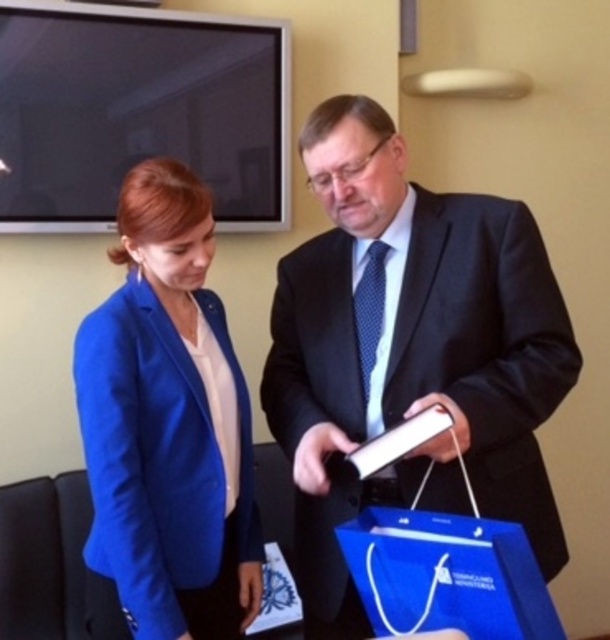
Question: Does matte black suit at center have a greater width compared to blue fabric jacket at left?

Choices:
 (A) no
 (B) yes

Answer: (B)

Question: Is matte black suit at center below blue fabric jacket at left?

Choices:
 (A) no
 (B) yes

Answer: (A)

Question: Which point is farther to the camera?

Choices:
 (A) (350, 179)
 (B) (149, 636)

Answer: (A)

Question: Which point appears farthest from the camera in this image?

Choices:
 (A) (90, 326)
 (B) (514, 433)

Answer: (A)

Question: From the image, what is the correct spatial relationship of matte black suit at center in relation to blue fabric jacket at left?

Choices:
 (A) left
 (B) right

Answer: (B)